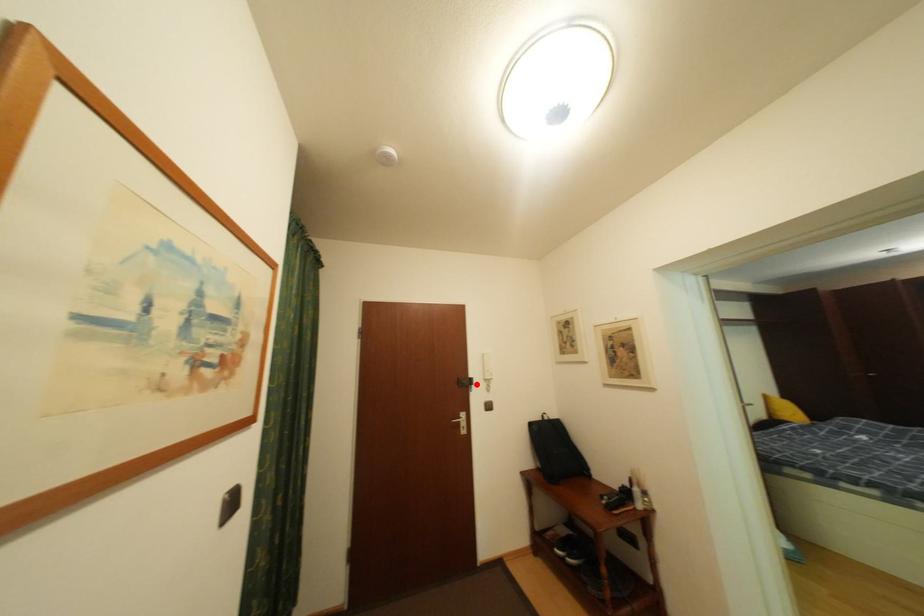
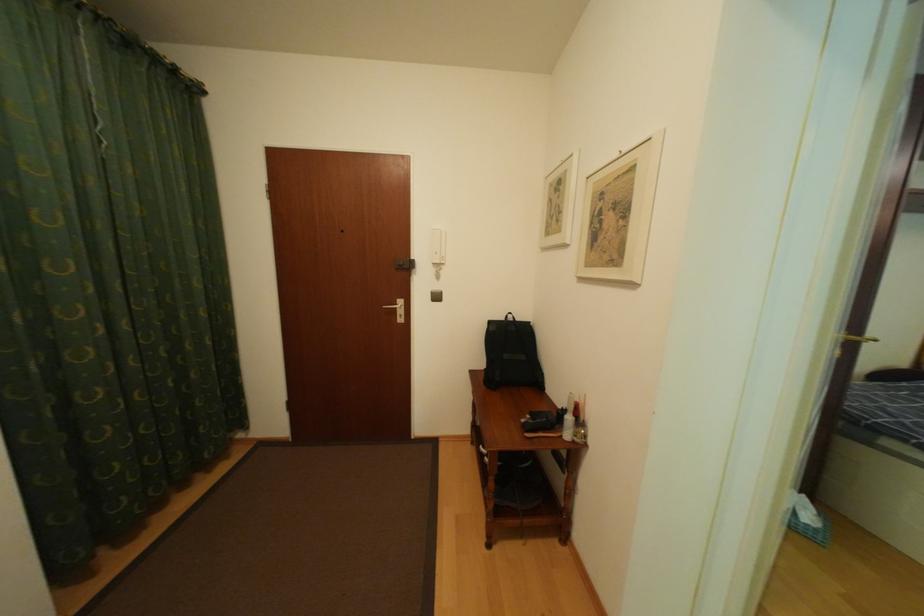
Locate, in the second image, the point that corresponds to the highlighted location in the first image.

(414, 265)